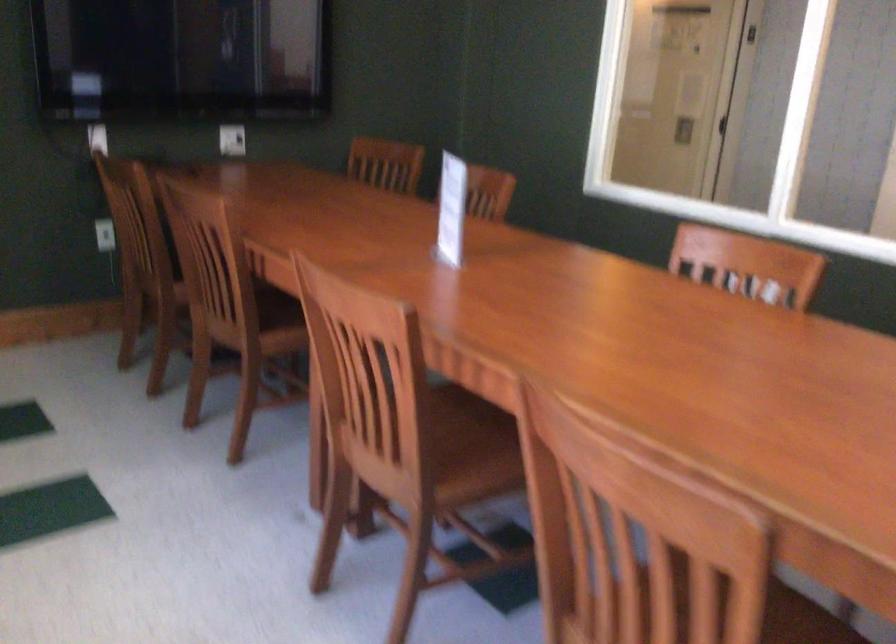
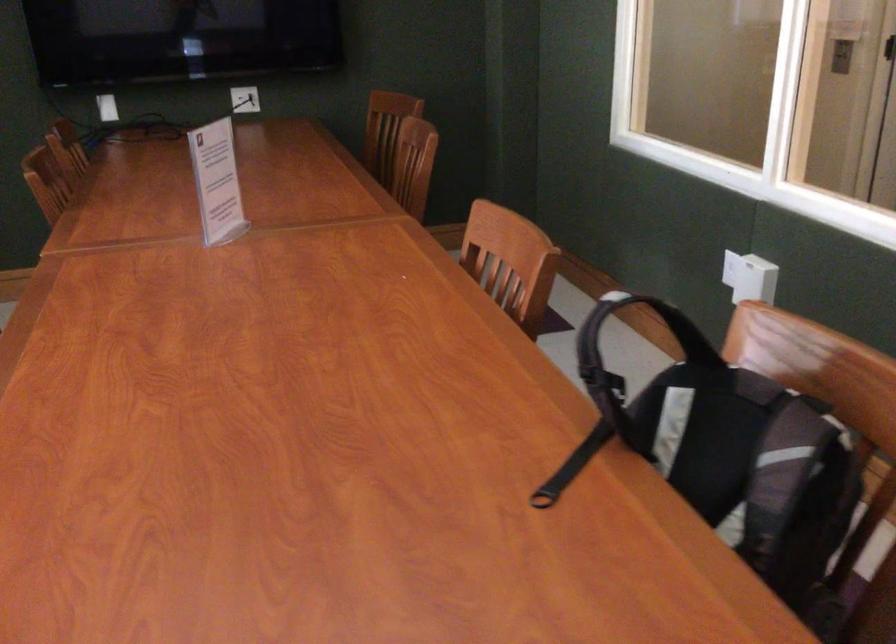
The point at (448, 210) is marked in the first image. Where is the corresponding point in the second image?

(217, 182)